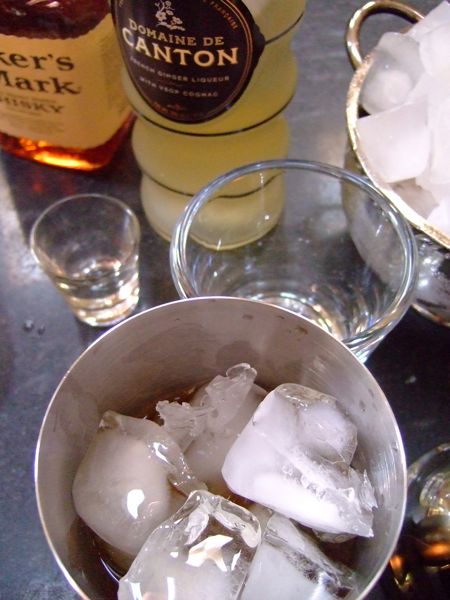
You are a GUI agent. You are given a task and a screenshot of the screen. Output one action in this format:
    pyautogui.click(x=<x>, y=<y>)
    Task: Click on the ice bucket handle
    The image size is (450, 600).
    Given the screenshot: What is the action you would take?
    tap(355, 23)